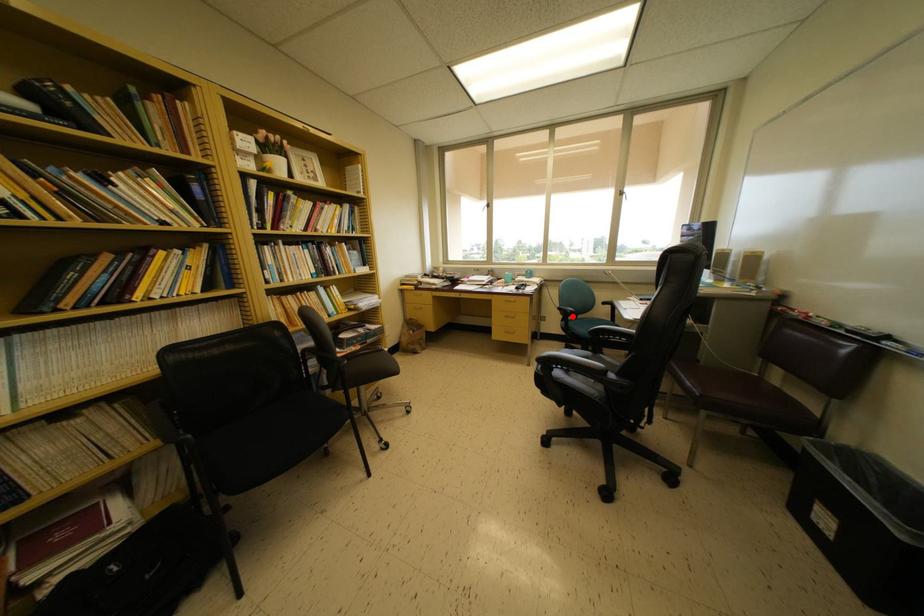
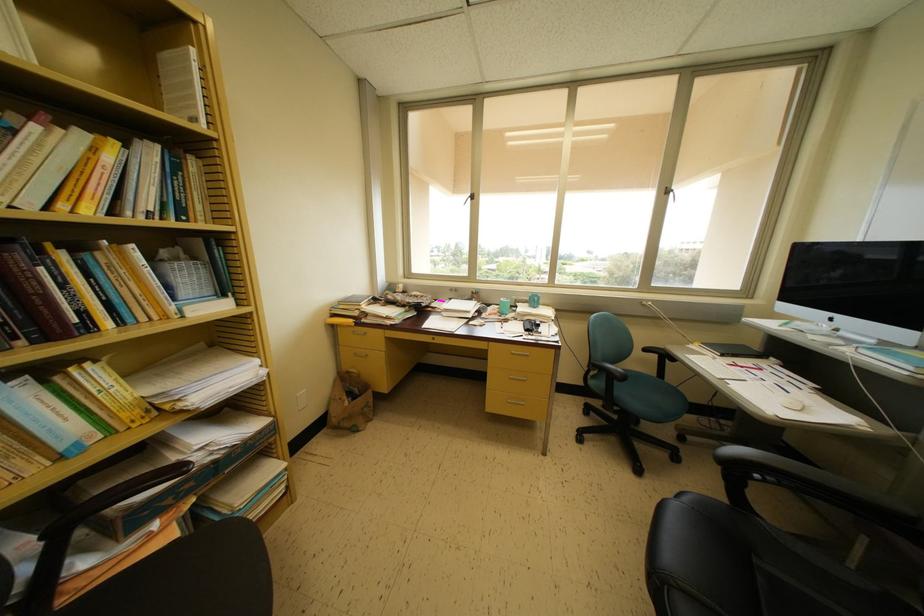
Question: I am providing you with two images of the same scene from different viewpoints. In image1, a red point is highlighted. Considering the same 3D point in image2, which of the following is correct?

Choices:
 (A) It is closer
 (B) It is farther

Answer: (B)